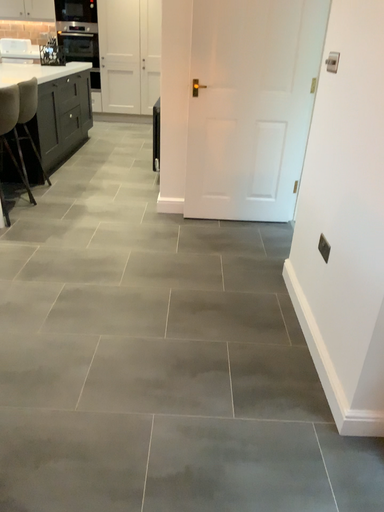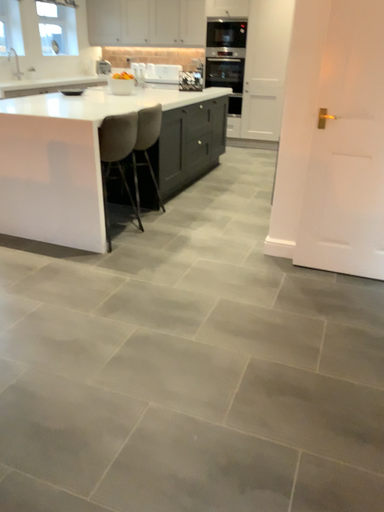
Question: How did the camera likely rotate when shooting the video?

Choices:
 (A) rotated right
 (B) rotated left

Answer: (B)